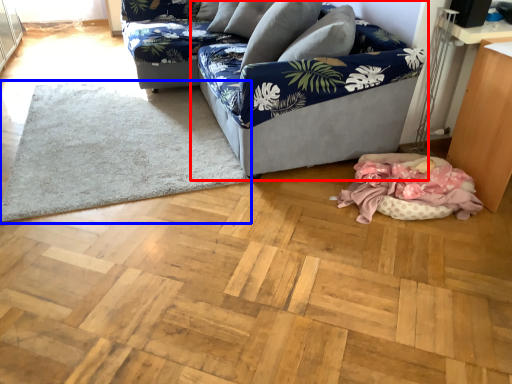
Question: Which point is closer to the camera, studio couch (highlighted by a red box) or mat (highlighted by a blue box)?

Choices:
 (A) studio couch
 (B) mat

Answer: (A)